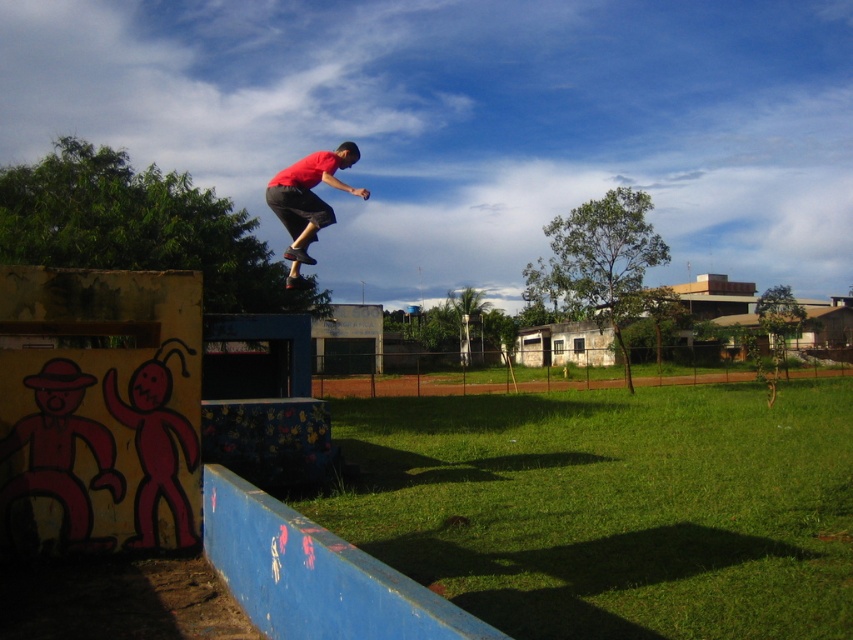
From the picture: Can you confirm if matte red shirt at center is thinner than wooden brown skateboard at center?

Correct, matte red shirt at center's width is less than wooden brown skateboard at center's.

Does point (287, 205) lie in front of point (297, 248)?

Yes.

Is point (305, 244) farther from viewer compared to point (291, 252)?

Yes, point (305, 244) is farther from viewer.

Locate an element on the screen. matte red shirt at center is located at coordinates (309, 192).